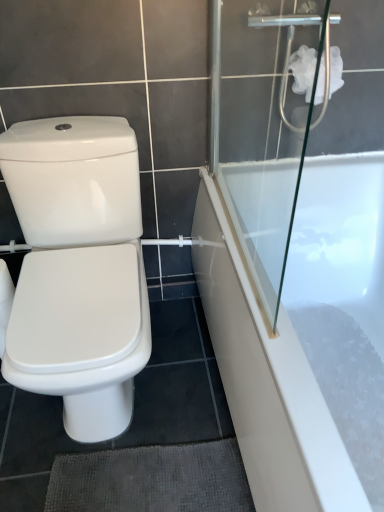
Question: In the image, is white glossy bathtub at right positioned in front of or behind transparent glass shower door at upper right?

Choices:
 (A) front
 (B) behind

Answer: (B)

Question: Looking at the image, does white glossy bathtub at right seem bigger or smaller compared to transparent glass shower door at upper right?

Choices:
 (A) small
 (B) big

Answer: (B)

Question: Estimate the real-world distances between objects in this image. Which object is closer to the white glossy bathtub at right?

Choices:
 (A) white fluffy toilet paper at upper right
 (B) white glossy bidet at left
 (C) transparent glass shower door at upper right

Answer: (C)

Question: Estimate the real-world distances between objects in this image. Which object is closer to the white glossy bidet at left?

Choices:
 (A) white glossy bathtub at right
 (B) transparent glass shower door at upper right
 (C) white fluffy toilet paper at upper right

Answer: (A)